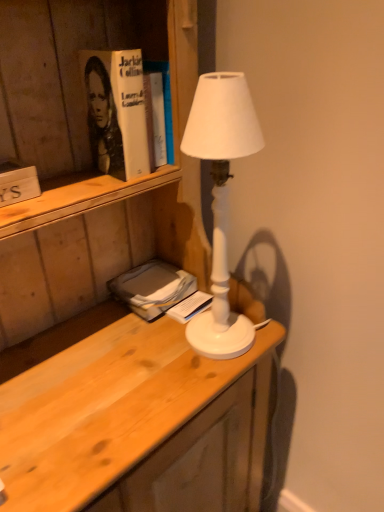
Question: Does point (142, 266) appear closer or farther from the camera than point (19, 195)?

Choices:
 (A) farther
 (B) closer

Answer: (A)

Question: In the image, is gray matte book at lower left, the 2th book when ordered from bottom to top, on the left side or the right side of wooden sign at left, which ranks as the 1th book in front-to-back order?

Choices:
 (A) right
 (B) left

Answer: (A)

Question: Which object is the farthest from the white paper book at center, marked as the 1th book in a right-to-left arrangement?

Choices:
 (A) white matte lamp at center
 (B) wooden sign at left, the third book in the bottom-to-top sequence
 (C) gray matte book at lower left, the 2th book in the back-to-front sequence
 (D) wooden desk at center
 (E) hardcover book at upper left

Answer: (B)

Question: Which object is positioned closest to the white paper book at center, positioned as the third book in front-to-back order?

Choices:
 (A) wooden desk at center
 (B) hardcover book at upper left
 (C) wooden sign at left, which is the 3th book in back-to-front order
 (D) white matte lamp at center
 (E) gray matte book at lower left, acting as the second book starting from the front

Answer: (E)